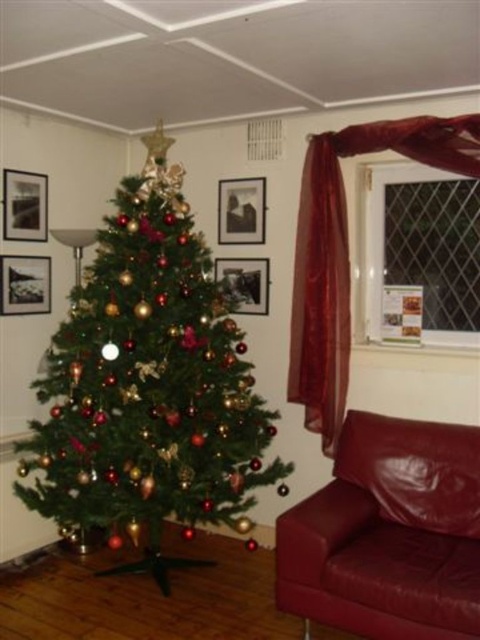
You are a guest entering the room and want to sit down. You see the green matte christmas tree at center and the leather couch at lower right. Which object is closer to you?

The green matte christmas tree at center is closer to you since the leather couch at lower right is behind it.

You are decorating the Christmas tree and need to hang an ornament. You want to place it exactly halfway between the black matte picture frame at upper left and the black matte picture frame at left. How far apart are these two frames?

The black matte picture frame at upper left is 27.80 centimeters away from the black matte picture frame at left. Therefore, the halfway point would be at 13.9 centimeters from each frame.